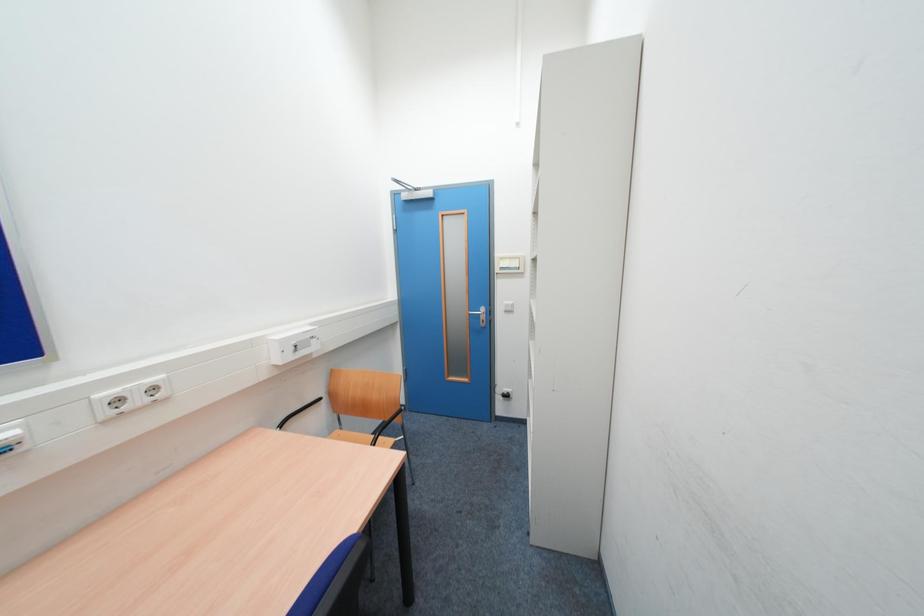
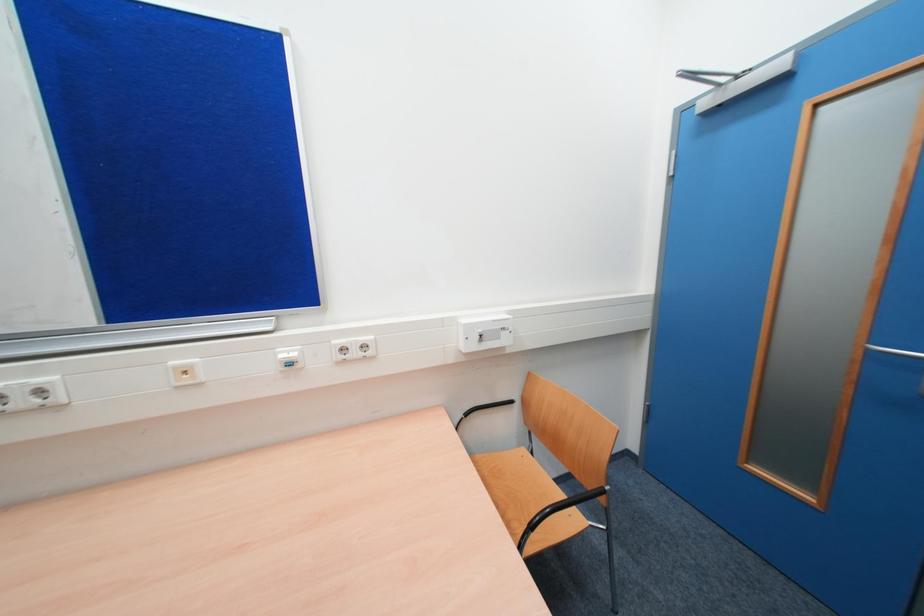
Question: Based on the continuous images, in which direction is the camera rotating? Reply with the corresponding letter.

Choices:
 (A) Left
 (B) Right
 (C) Up
 (D) Down

Answer: (A)